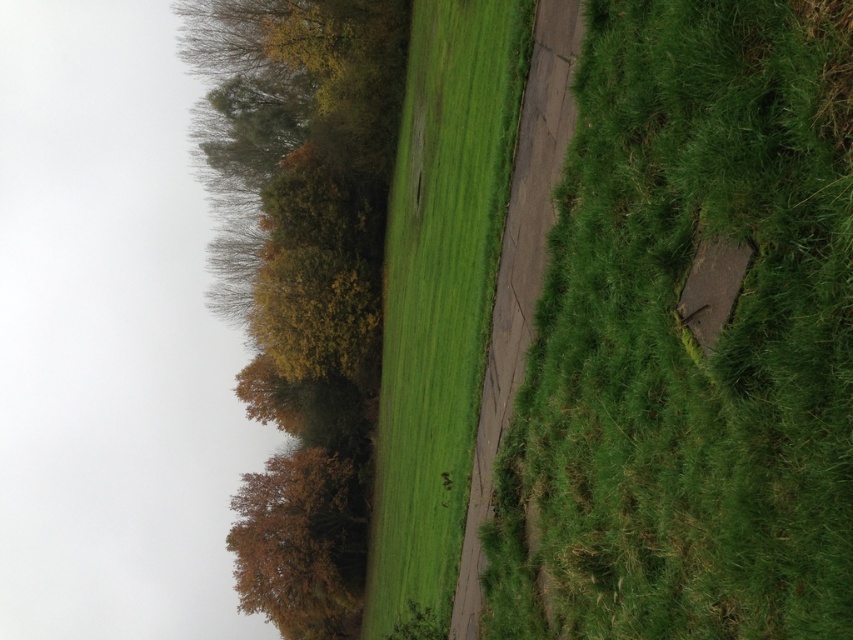
Question: Which point is closer to the camera?

Choices:
 (A) (815, 333)
 (B) (434, 124)
 (C) (335, 58)

Answer: (A)

Question: Among these objects, which one is farthest from the camera?

Choices:
 (A) yellow-green foliage at upper left
 (B) green grassy at right
 (C) green grassy at center

Answer: (A)

Question: Is yellow-green foliage at upper left behind green grassy at center?

Choices:
 (A) yes
 (B) no

Answer: (A)

Question: Is green grassy at right above green grassy at center?

Choices:
 (A) no
 (B) yes

Answer: (B)

Question: From the image, what is the correct spatial relationship of yellow-green foliage at upper left in relation to green grassy at center?

Choices:
 (A) right
 (B) left

Answer: (B)

Question: Which point is farther to the camera?

Choices:
 (A) yellow-green foliage at upper left
 (B) green grassy at center

Answer: (A)